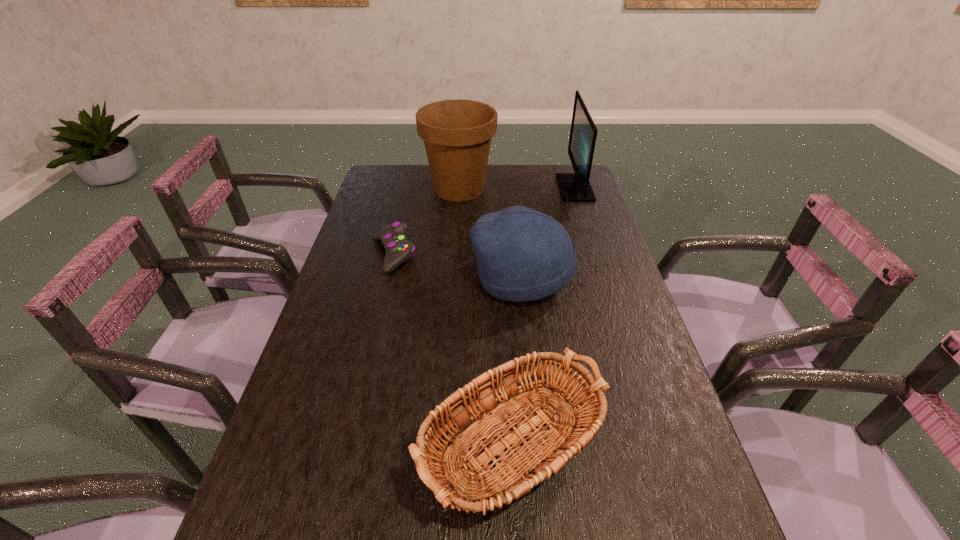
The width and height of the screenshot is (960, 540). In order to click on free area in between the third shortest object and the control in this screenshot , I will do `click(457, 266)`.

Where is `free point between the flowerpot and the shortest object`? The image size is (960, 540). free point between the flowerpot and the shortest object is located at coordinates (426, 221).

At what (x,y) coordinates should I click in order to perform the action: click on vacant area between the skullcap and the control. Please return your answer as a coordinate pair (x, y). This screenshot has width=960, height=540. Looking at the image, I should click on (457, 266).

Where is `empty location between the flowerpot and the control`? Image resolution: width=960 pixels, height=540 pixels. empty location between the flowerpot and the control is located at coordinates (426, 221).

Select which object is the closest to the fourth tallest object. Please provide its 2D coordinates. Your answer should be formatted as a tuple, i.e. [(x, y)], where the tuple contains the x and y coordinates of a point satisfying the conditions above.

[(523, 255)]

Find the location of a particular element. Image resolution: width=960 pixels, height=540 pixels. the third closest object to the rightmost object is located at coordinates (398, 249).

Locate an element on the screen. This screenshot has height=540, width=960. vacant space that satisfies the following two spatial constraints: 1. on the front side of the skullcap; 2. on the right side of the flowerpot is located at coordinates (453, 277).